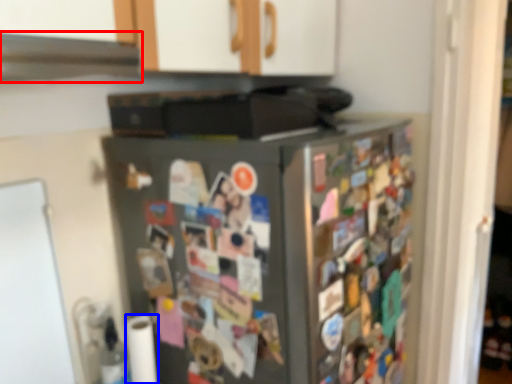
Question: Which object is further to the camera taking this photo, exhaust hood (highlighted by a red box) or toilet paper (highlighted by a blue box)?

Choices:
 (A) exhaust hood
 (B) toilet paper

Answer: (B)